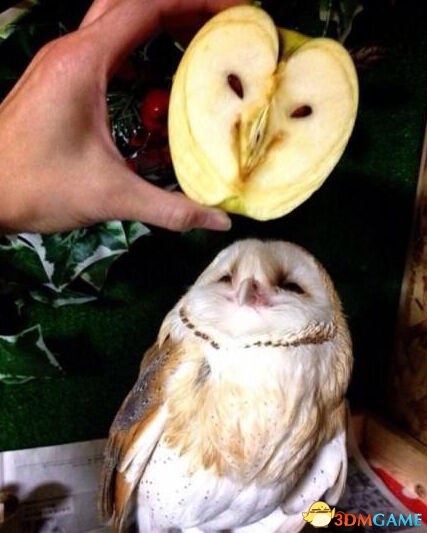
In order to click on chest in this screenshot , I will do `click(260, 399)`.